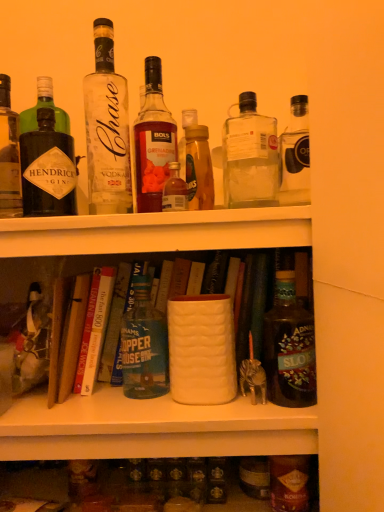
Question: Considering the relative sizes of clear glass bottle at upper center, marked as the seventh bottle in a right-to-left arrangement, and green glass bottle at center, the third bottle positioned from the left, in the image provided, is clear glass bottle at upper center, marked as the seventh bottle in a right-to-left arrangement, shorter than green glass bottle at center, the third bottle positioned from the left,?

Choices:
 (A) no
 (B) yes

Answer: (A)

Question: Is clear glass bottle at upper center, marked as the seventh bottle in a right-to-left arrangement, touching green glass bottle at center, the third bottle positioned from the left?

Choices:
 (A) yes
 (B) no

Answer: (B)

Question: Considering the relative sizes of clear glass bottle at upper center, marked as the seventh bottle in a right-to-left arrangement, and green glass bottle at center, the third bottle positioned from the left, in the image provided, is clear glass bottle at upper center, marked as the seventh bottle in a right-to-left arrangement, wider than green glass bottle at center, the third bottle positioned from the left,?

Choices:
 (A) yes
 (B) no

Answer: (B)

Question: Is clear glass bottle at upper center, the 2th bottle when ordered from left to right, closer to the viewer compared to green glass bottle at center, which is the 6th bottle from right to left?

Choices:
 (A) yes
 (B) no

Answer: (A)

Question: From the image's perspective, would you say clear glass bottle at upper center, marked as the seventh bottle in a right-to-left arrangement, is positioned over green glass bottle at center, which is the 6th bottle from right to left?

Choices:
 (A) no
 (B) yes

Answer: (B)

Question: Considering the relative positions of clear glass bottle at upper center, marked as the 3th bottle in a right-to-left arrangement, and green glass bottle at center, which is the 6th bottle from right to left, in the image provided, is clear glass bottle at upper center, marked as the 3th bottle in a right-to-left arrangement, to the left or to the right of green glass bottle at center, which is the 6th bottle from right to left,?

Choices:
 (A) left
 (B) right

Answer: (B)

Question: Do you think clear glass bottle at upper center, acting as the 6th bottle starting from the left, is within green glass bottle at center, which is the 6th bottle from right to left, or outside of it?

Choices:
 (A) outside
 (B) inside

Answer: (A)

Question: In terms of height, does clear glass bottle at upper center, acting as the 6th bottle starting from the left, look taller or shorter compared to green glass bottle at center, which is the 6th bottle from right to left?

Choices:
 (A) short
 (B) tall

Answer: (B)

Question: From the image's perspective, relative to green glass bottle at center, the third bottle positioned from the left, is clear glass bottle at upper center, acting as the 6th bottle starting from the left, above or below?

Choices:
 (A) above
 (B) below

Answer: (A)

Question: From their relative heights in the image, would you say green glass bottle at center, which is the 6th bottle from right to left, is taller or shorter than hardcover book at center, the 2th book positioned from the right?

Choices:
 (A) short
 (B) tall

Answer: (B)

Question: From the image's perspective, relative to hardcover book at center, acting as the second book starting from the left, is green glass bottle at center, which is the 6th bottle from right to left, above or below?

Choices:
 (A) above
 (B) below

Answer: (B)

Question: In terms of width, does green glass bottle at center, which is the 6th bottle from right to left, look wider or thinner when compared to hardcover book at center, the 2th book positioned from the right?

Choices:
 (A) thin
 (B) wide

Answer: (A)

Question: Do you think green glass bottle at center, the third bottle positioned from the left, is within hardcover book at center, the 2th book positioned from the right, or outside of it?

Choices:
 (A) outside
 (B) inside

Answer: (A)

Question: Is hardcover book at center, the 2th book positioned from the right, bigger or smaller than hardcover book at center, placed as the first book when sorted from left to right?

Choices:
 (A) big
 (B) small

Answer: (B)

Question: Looking at their shapes, would you say hardcover book at center, the 2th book positioned from the right, is wider or thinner than hardcover book at center, placed as the third book when sorted from right to left?

Choices:
 (A) wide
 (B) thin

Answer: (B)